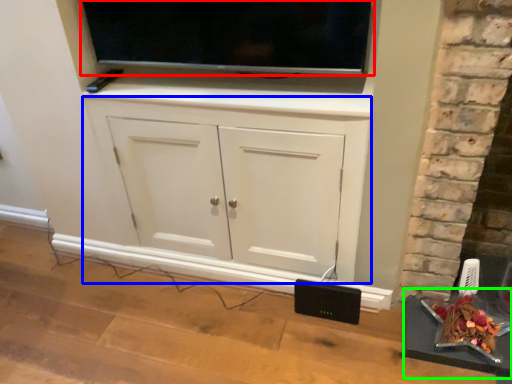
Question: Which object is the farthest from television (highlighted by a red box)? Choose among these: cabinetry (highlighted by a blue box) or table (highlighted by a green box).

Choices:
 (A) cabinetry
 (B) table

Answer: (B)